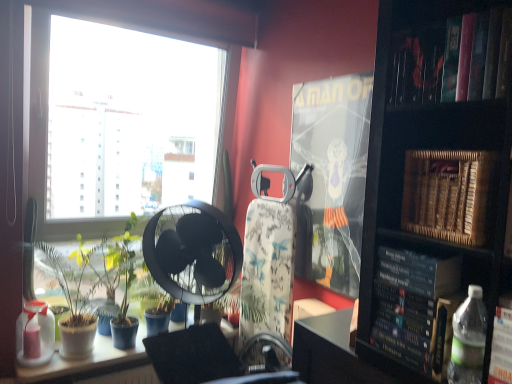
Question: Considering the relative positions of hardcover book at right, which appears as the 2th paperback book when viewed from the back, and metallic swivel chair at center in the image provided, is hardcover book at right, which appears as the 2th paperback book when viewed from the back, to the right of metallic swivel chair at center from the viewer's perspective?

Choices:
 (A) yes
 (B) no

Answer: (A)

Question: Is the position of hardcover book at right, which appears as the 2th paperback book when viewed from the back, more distant than that of metallic swivel chair at center?

Choices:
 (A) yes
 (B) no

Answer: (A)

Question: Considering the relative sizes of hardcover book at right, which appears as the 2th paperback book when viewed from the back, and metallic swivel chair at center in the image provided, is hardcover book at right, which appears as the 2th paperback book when viewed from the back, taller than metallic swivel chair at center?

Choices:
 (A) yes
 (B) no

Answer: (A)

Question: From the image's perspective, is hardcover book at right, which appears as the second paperback book when viewed from the front, on metallic swivel chair at center?

Choices:
 (A) yes
 (B) no

Answer: (A)

Question: Is hardcover book at right, which appears as the 2th paperback book when viewed from the back, thinner than metallic swivel chair at center?

Choices:
 (A) yes
 (B) no

Answer: (B)

Question: In terms of size, does green matte plant at lower left, positioned as the second plant in right-to-left order, appear bigger or smaller than hardcover book at right, which appears as the second paperback book when viewed from the front?

Choices:
 (A) small
 (B) big

Answer: (B)

Question: Is green matte plant at lower left, which ranks as the first plant in left-to-right order, in front of or behind hardcover book at right, which appears as the 2th paperback book when viewed from the back, in the image?

Choices:
 (A) behind
 (B) front

Answer: (A)

Question: Based on their positions, is green matte plant at lower left, which ranks as the first plant in left-to-right order, located to the left or right of hardcover book at right, which appears as the 2th paperback book when viewed from the back?

Choices:
 (A) right
 (B) left

Answer: (B)

Question: Is point (100, 253) closer or farther from the camera than point (424, 365)?

Choices:
 (A) farther
 (B) closer

Answer: (A)

Question: Visually, is translucent plastic bottle at lower left, placed as the second bottle when sorted from top to bottom, positioned to the left or to the right of white glossy table at lower left?

Choices:
 (A) right
 (B) left

Answer: (B)

Question: Based on their sizes in the image, would you say translucent plastic bottle at lower left, placed as the first bottle when sorted from back to front, is bigger or smaller than white glossy table at lower left?

Choices:
 (A) small
 (B) big

Answer: (A)

Question: Is translucent plastic bottle at lower left, the second bottle from the right, wider or thinner than white glossy table at lower left?

Choices:
 (A) thin
 (B) wide

Answer: (A)

Question: Is translucent plastic bottle at lower left, the second bottle when ordered from front to back, situated inside white glossy table at lower left or outside?

Choices:
 (A) outside
 (B) inside

Answer: (A)

Question: Relative to hardcover book at upper right, is hardcover book at right, which appears as the second paperback book when viewed from the front, in front or behind?

Choices:
 (A) behind
 (B) front

Answer: (A)

Question: From a real-world perspective, is hardcover book at right, which appears as the second paperback book when viewed from the front, above or below hardcover book at upper right?

Choices:
 (A) below
 (B) above

Answer: (A)